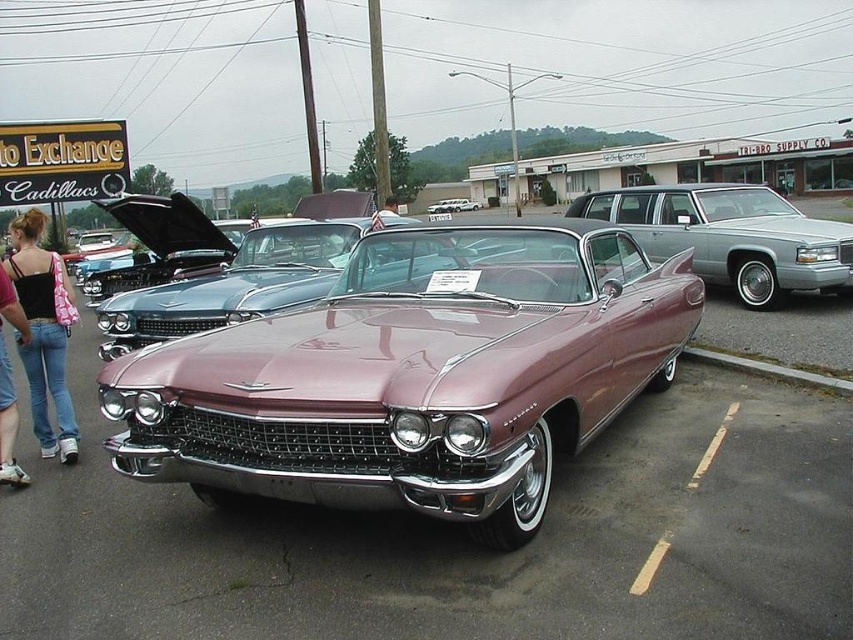
Question: Which object is the closest to the shiny chrome convertible at center?

Choices:
 (A) pink denim jeans at lower left
 (B) shiny maroon convertible at center
 (C) metallic silver station wagon at center

Answer: (C)

Question: Is metallic silver station wagon at center positioned before shiny chrome convertible at center?

Choices:
 (A) yes
 (B) no

Answer: (A)

Question: Does metallic silver station wagon at center have a larger size compared to pink denim jeans at lower left?

Choices:
 (A) yes
 (B) no

Answer: (A)

Question: Which point is closer to the camera?

Choices:
 (A) (474, 208)
 (B) (447, 339)

Answer: (B)

Question: Among these points, which one is farthest from the camera?

Choices:
 (A) (61, 454)
 (B) (813, 282)

Answer: (B)

Question: Is shiny maroon convertible at center positioned behind metallic silver station wagon at center?

Choices:
 (A) yes
 (B) no

Answer: (B)